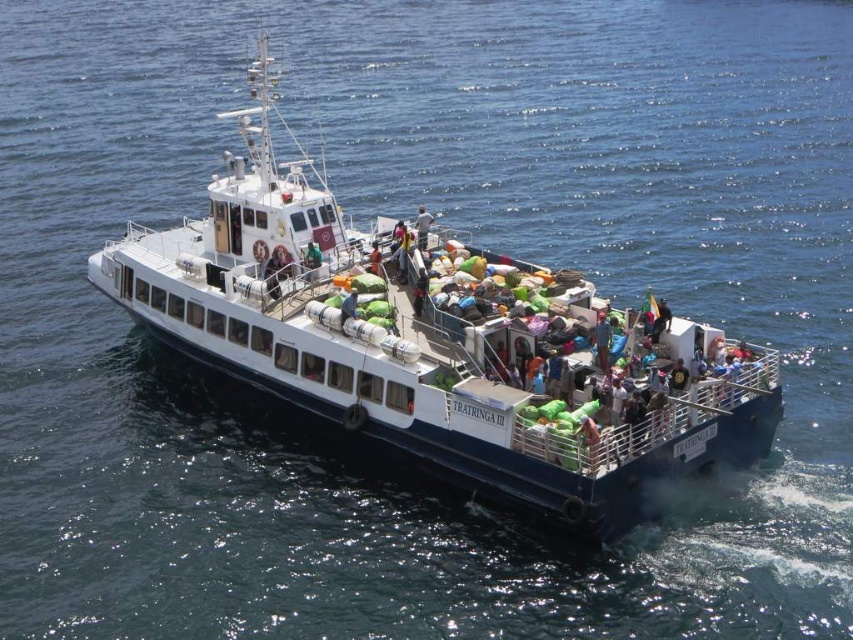
Between white matte boat at center and light brown wooden chair at center, which one is positioned higher?

white matte boat at center is higher up.

Image resolution: width=853 pixels, height=640 pixels. Find the location of `white matte boat at center`. white matte boat at center is located at coordinates (434, 342).

The height and width of the screenshot is (640, 853). Identify the location of white matte boat at center. (434, 342).